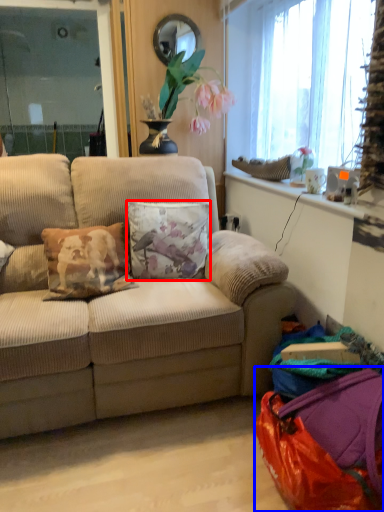
Question: Which point is further to the camera, pillow (highlighted by a red box) or bag (highlighted by a blue box)?

Choices:
 (A) pillow
 (B) bag

Answer: (A)